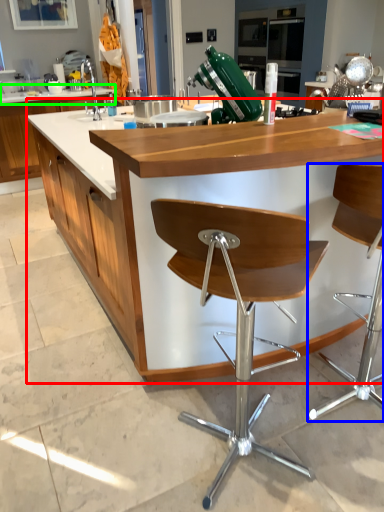
Question: Which is nearer to the countertop (highlighted by a red box)? chair (highlighted by a blue box) or countertop (highlighted by a green box).

Choices:
 (A) chair
 (B) countertop

Answer: (A)